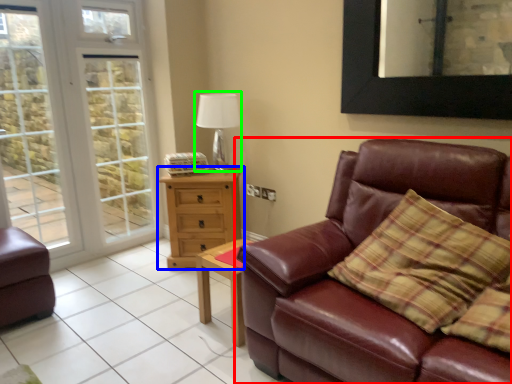
Question: Which object is the closest to the studio couch (highlighted by a red box)? Choose among these: chest of drawers (highlighted by a blue box) or table lamp (highlighted by a green box).

Choices:
 (A) chest of drawers
 (B) table lamp

Answer: (A)